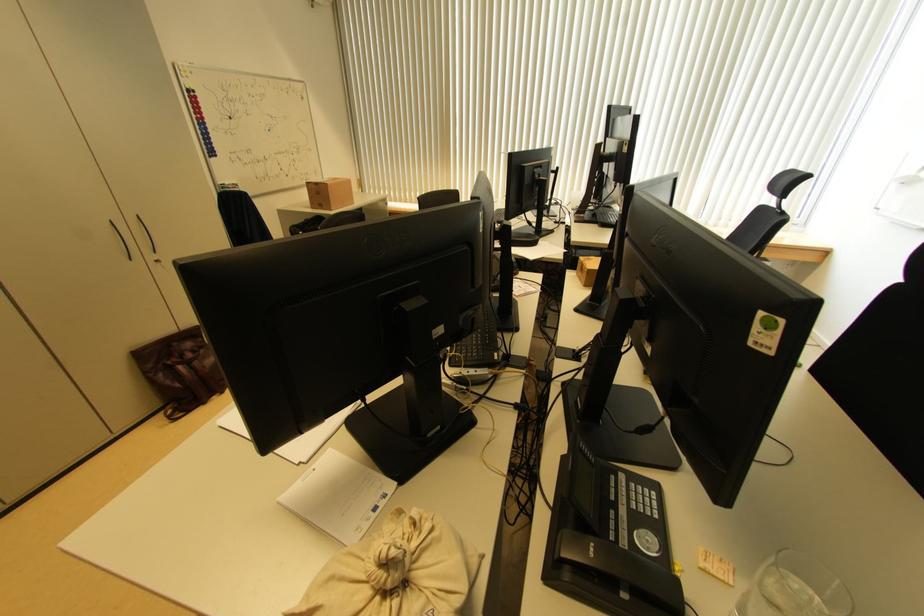
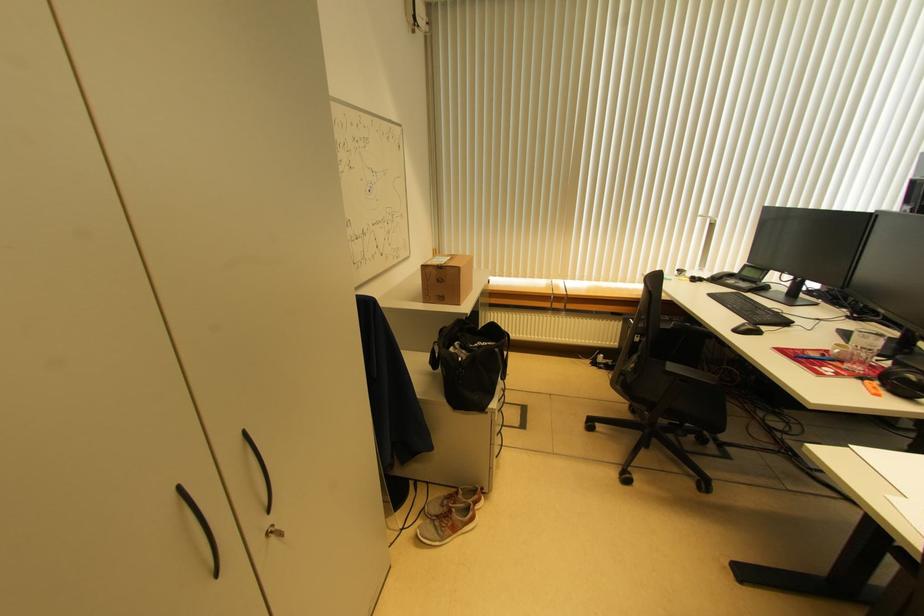
Locate, in the second image, the point that corresponds to point 329,188 in the first image.

(459, 272)